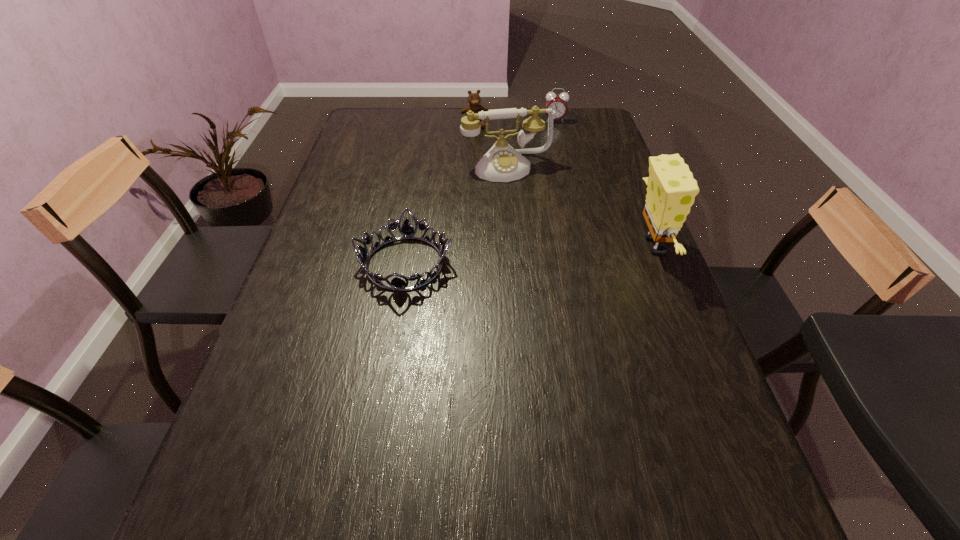
Select which object appears as the third closest to the shortest object. Please provide its 2D coordinates. Your answer should be formatted as a tuple, i.e. [(x, y)], where the tuple contains the x and y coordinates of a point satisfying the conditions above.

[(474, 99)]

The height and width of the screenshot is (540, 960). Identify the location of vacant area in the image that satisfies the following two spatial constraints: 1. on the back side of the third farthest object; 2. on the left side of the second object from right to left. (503, 121).